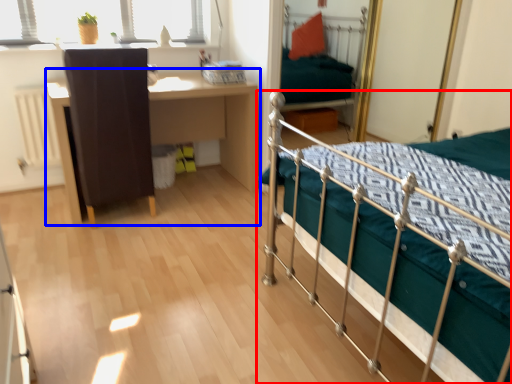
Question: Which object is closer to the camera taking this photo, bed (highlighted by a red box) or desk (highlighted by a blue box)?

Choices:
 (A) bed
 (B) desk

Answer: (A)